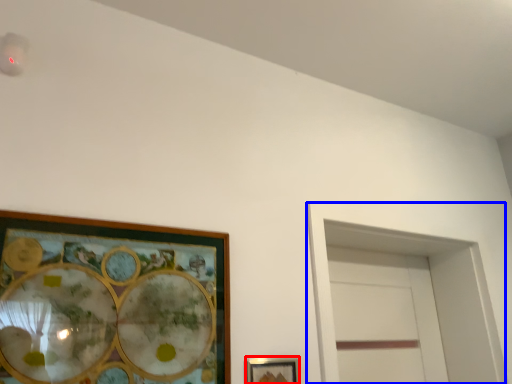
Question: Among these objects, which one is nearest to the camera, picture frame (highlighted by a red box) or glass door (highlighted by a blue box)?

Choices:
 (A) picture frame
 (B) glass door

Answer: (A)